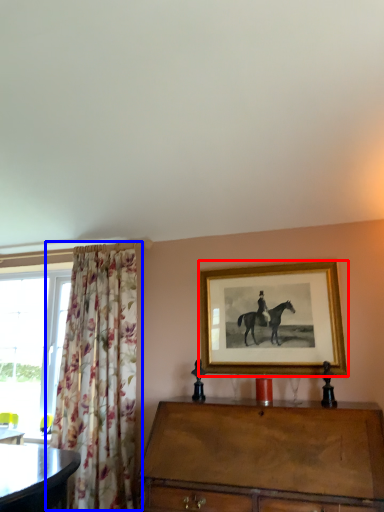
Question: Which object appears farthest to the camera in this image, picture frame (highlighted by a red box) or curtain (highlighted by a blue box)?

Choices:
 (A) picture frame
 (B) curtain

Answer: (A)